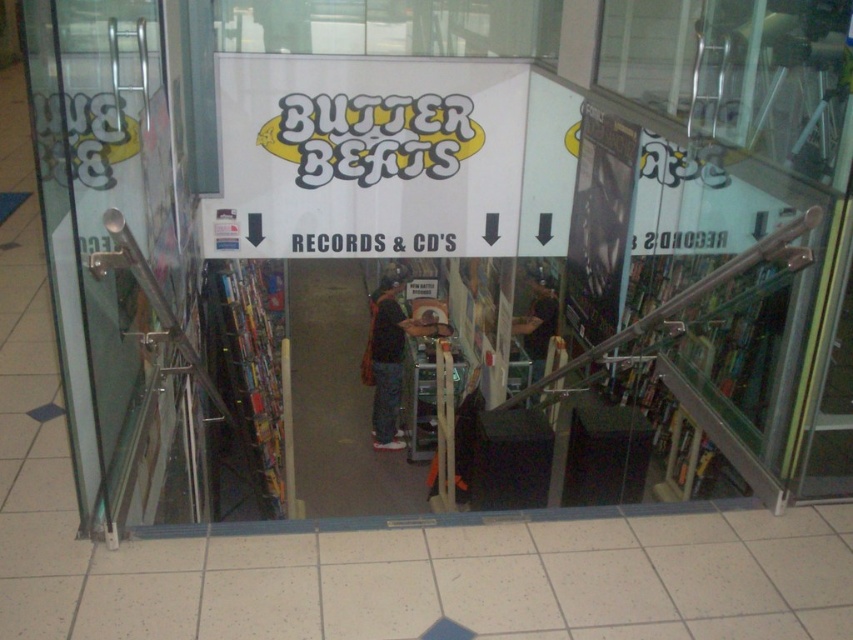
Can you confirm if transparent glass door at left is positioned to the right of dark gray carpet at center?

Incorrect, transparent glass door at left is not on the right side of dark gray carpet at center.

Which of these two, transparent glass door at left or dark gray carpet at center, stands taller?

dark gray carpet at center

Which is in front, point (59, 195) or point (300, 468)?

Point (59, 195)

Find the location of a particular element. transparent glass door at left is located at coordinates (99, 209).